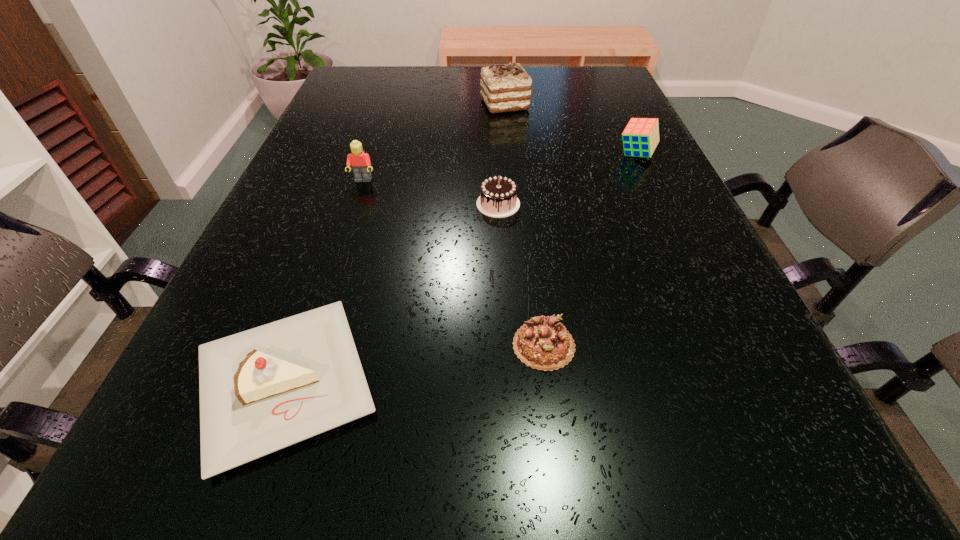
The image size is (960, 540). In order to click on free space between the Lego and the second tallest chocolate cake in this screenshot , I will do `click(430, 192)`.

This screenshot has width=960, height=540. I want to click on empty space between the tallest chocolate cake and the cube, so click(x=570, y=129).

At what (x,y) coordinates should I click in order to perform the action: click on blank region between the rightmost object and the farthest object. Please return your answer as a coordinate pair (x, y). Looking at the image, I should click on (570, 129).

You are a GUI agent. You are given a task and a screenshot of the screen. Output one action in this format:
    pyautogui.click(x=<x>, y=<y>)
    Task: Click on the vacant space that's between the second shortest chocolate cake and the cake
    
    Given the screenshot: What is the action you would take?
    pyautogui.click(x=392, y=293)

The height and width of the screenshot is (540, 960). I want to click on free space between the shortest object and the third farthest object, so click(x=453, y=263).

At what (x,y) coordinates should I click in order to perform the action: click on the closest object relative to the tallest chocolate cake. Please return your answer as a coordinate pair (x, y). Looking at the image, I should click on (640, 137).

Where is `object that is the second closest one to the third farthest object`? The image size is (960, 540). object that is the second closest one to the third farthest object is located at coordinates (261, 390).

I want to click on chocolate cake that is the closest to the fourth nearest object, so click(x=498, y=198).

Identify the location of the second closest chocolate cake to the nearest chocolate cake. (504, 87).

Where is `free space that satisfies the following two spatial constraints: 1. on the front side of the farthest object; 2. on the left side of the nearest chocolate cake`? The height and width of the screenshot is (540, 960). free space that satisfies the following two spatial constraints: 1. on the front side of the farthest object; 2. on the left side of the nearest chocolate cake is located at coordinates (525, 345).